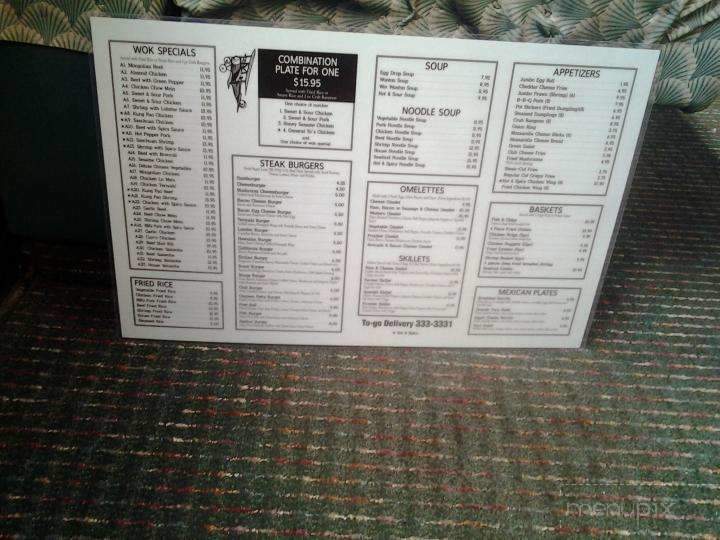
Identify the location of couch. (631, 19).